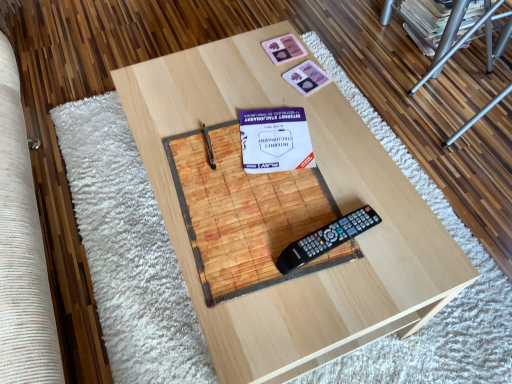
You are a GUI agent. You are given a task and a screenshot of the screen. Output one action in this format:
    pyautogui.click(x=<x>, y=<y>)
    Task: Click on the vacant area in front of black plastic remote control at center
    
    Given the screenshot: What is the action you would take?
    pyautogui.click(x=328, y=302)